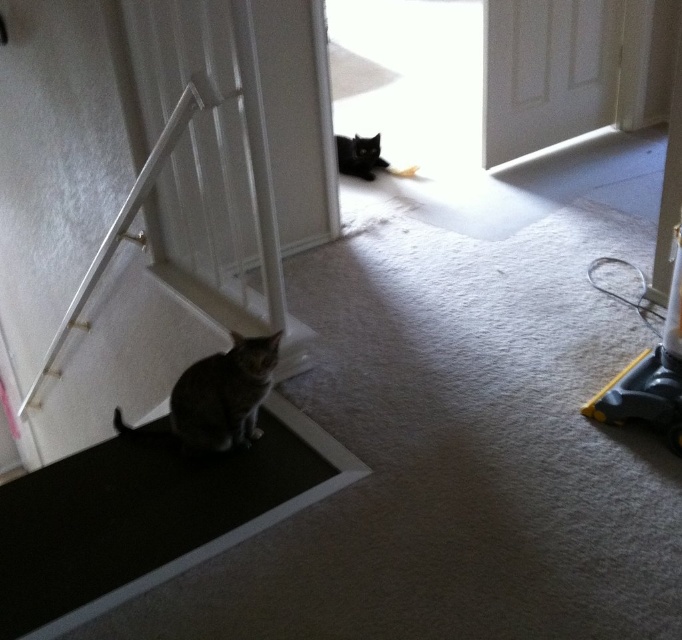
You are a delivery person trying to enter the house through the white glossy door at upper center. There is a gray striped cat at lower left blocking your path. Can you step over the cat without opening the door first?

The white glossy door at upper center is larger in size compared to the gray striped cat at lower left, but the door size does not affect your ability to step over the cat. You can step over the gray striped cat at lower left as long as you can physically maneuver around or over it, considering its size and your own ability.

You are a delivery person carrying a large box that is 1 meter wide. You need to enter the house through the white glossy door at upper center. However, there is a gray striped cat at lower left blocking the path. Can the cat move aside to let you pass through the door?

The white glossy door at upper center might be wider than gray striped cat at lower left, so the cat can move aside to let you pass through the door.